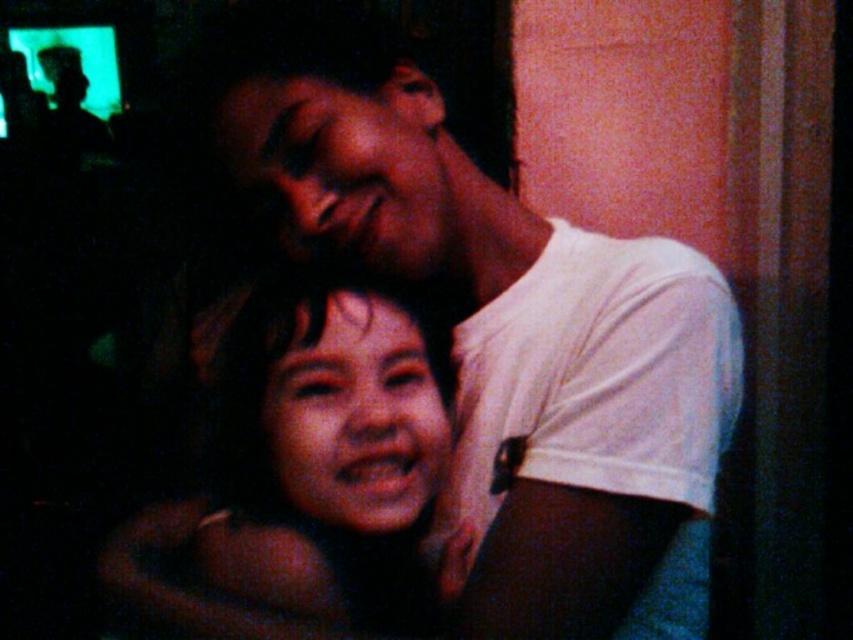
Question: Does white matte shirt at upper right have a smaller size compared to smooth skin face at center?

Choices:
 (A) yes
 (B) no

Answer: (B)

Question: From the image, what is the correct spatial relationship of white matte shirt at upper right in relation to smooth skin face at center?

Choices:
 (A) right
 (B) left

Answer: (A)

Question: Is the position of white matte shirt at upper right more distant than that of smooth skin face at center?

Choices:
 (A) no
 (B) yes

Answer: (A)

Question: Which point is closer to the camera?

Choices:
 (A) white matte shirt at upper right
 (B) smooth skin face at center

Answer: (A)

Question: Which point is closer to the camera?

Choices:
 (A) (x=186, y=612)
 (B) (x=263, y=108)

Answer: (B)